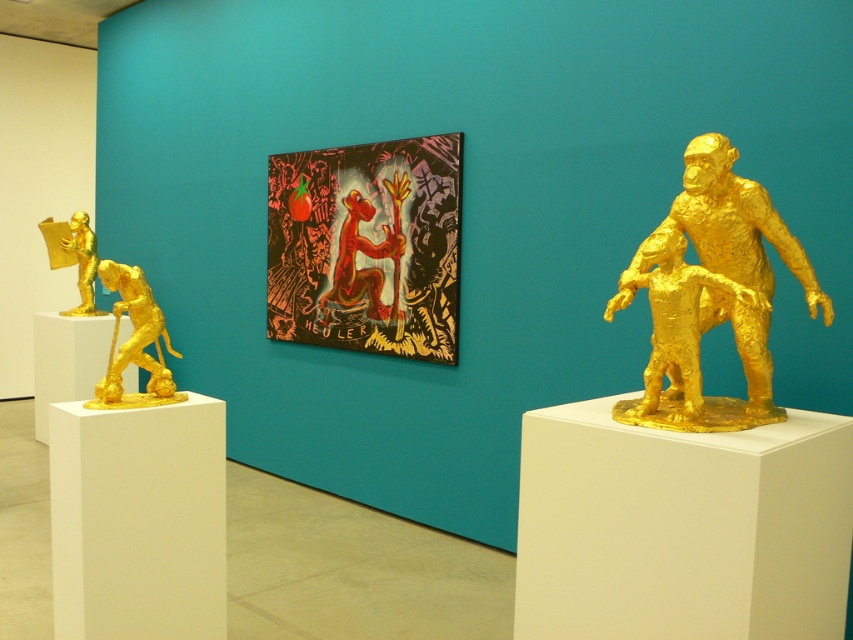
Question: Which point is farther to the camera?

Choices:
 (A) (149, 388)
 (B) (674, 262)
 (C) (344, 204)
 (D) (379, 186)

Answer: (C)

Question: Where is shiny red tomato at center located in relation to gold metallic figure at left in the image?

Choices:
 (A) left
 (B) right

Answer: (B)

Question: In this image, where is shiny red tomato at center located relative to gold metallic figure at right?

Choices:
 (A) above
 (B) below

Answer: (A)

Question: Which point is farther to the camera?

Choices:
 (A) gold textured sculpture at right
 (B) shiny red tomato at center
 (C) gold shiny dog at left
 (D) metallic red figure at center

Answer: (D)

Question: Observing the image, what is the correct spatial positioning of shiny red tomato at center in reference to gold metallic figure at left?

Choices:
 (A) right
 (B) left

Answer: (A)

Question: Which object appears farthest from the camera in this image?

Choices:
 (A) metallic red figure at center
 (B) gold shiny dog at left
 (C) gold textured sculpture at right
 (D) gold metallic figure at right

Answer: (A)